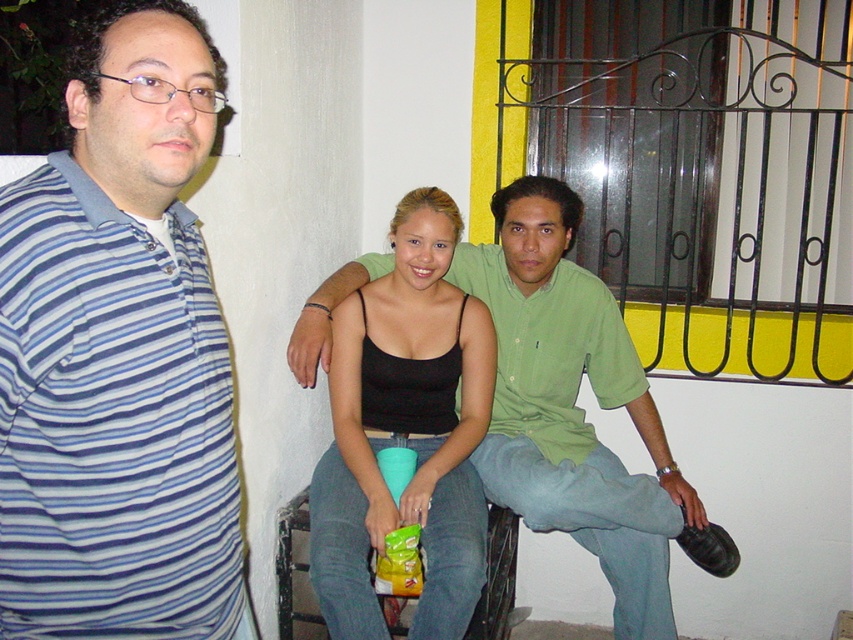
You are a photographer setting up a photo shoot in this scene. You need to place a 1.2 meter wide backdrop that must be wider than both the blue striped shirt at left and the black matte tank top at center. Based on their widths, will the backdrop be sufficient?

The blue striped shirt at left is narrower than the black matte tank top at center. Since the backdrop is 1.2 meters wide, it will be wider than both the blue striped shirt at left and the black matte tank top at center, making it sufficient for the photo shoot.